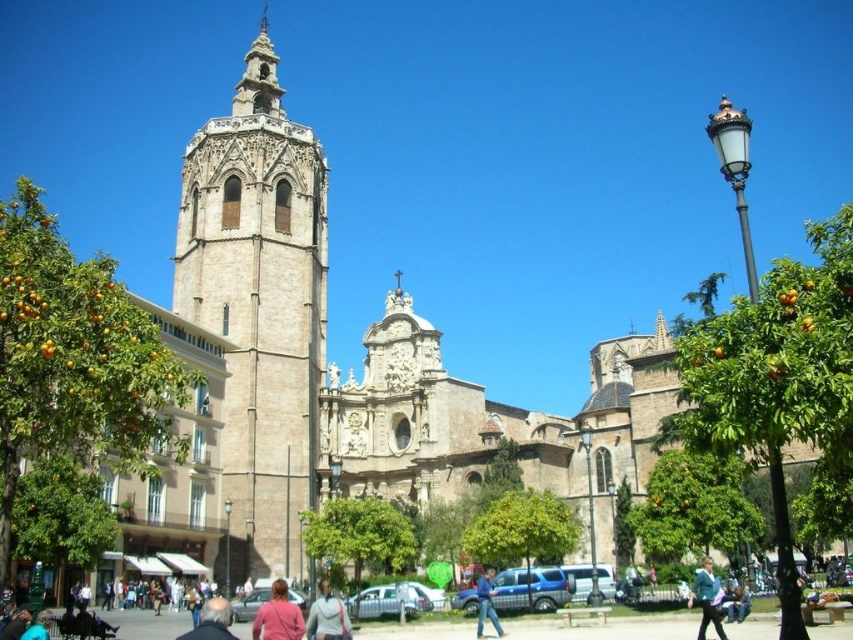
You are a photographer standing in the plaza in front of the historic church. You notice two items on the ground near your feet. One is a blue denim jacket at lower right and the other is a blue jeans at lower center. Which item takes up more space on the ground?

The blue denim jacket at lower right takes up more space on the ground because it is bigger than the blue jeans at lower center according to the description.

You are a photographer standing in the plaza and want to capture both the beige stone bell tower at left and the dark blue jacket at center in a single frame. Which object should you focus on first to ensure both are in the frame?

You should focus on the beige stone bell tower at left first because it might be wider than the dark blue jacket at center, so centering on the tower will help include both in the frame.

You are standing in the plaza and want to take a photo of the dark blue jacket at center while also including the beige stone bell tower at left in the frame. Based on their positions, will you need to adjust your camera angle to the left or right to capture both in the same shot?

The beige stone bell tower at left is to the left of the dark blue jacket at center, so you will need to adjust your camera angle to the left to include both in the same shot.